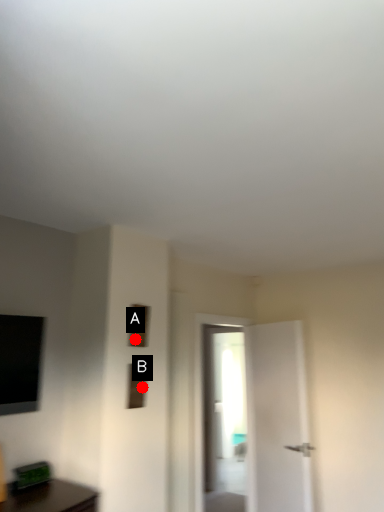
Question: Two points are circled on the image, labeled by A and B beside each circle. Which of the following is the closest to the observer?

Choices:
 (A) A is closer
 (B) B is closer

Answer: (B)